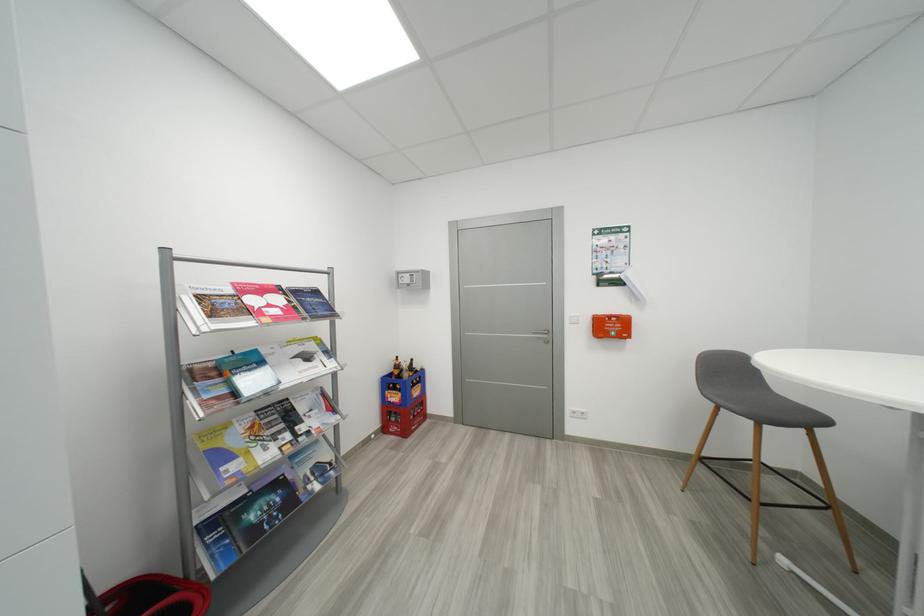
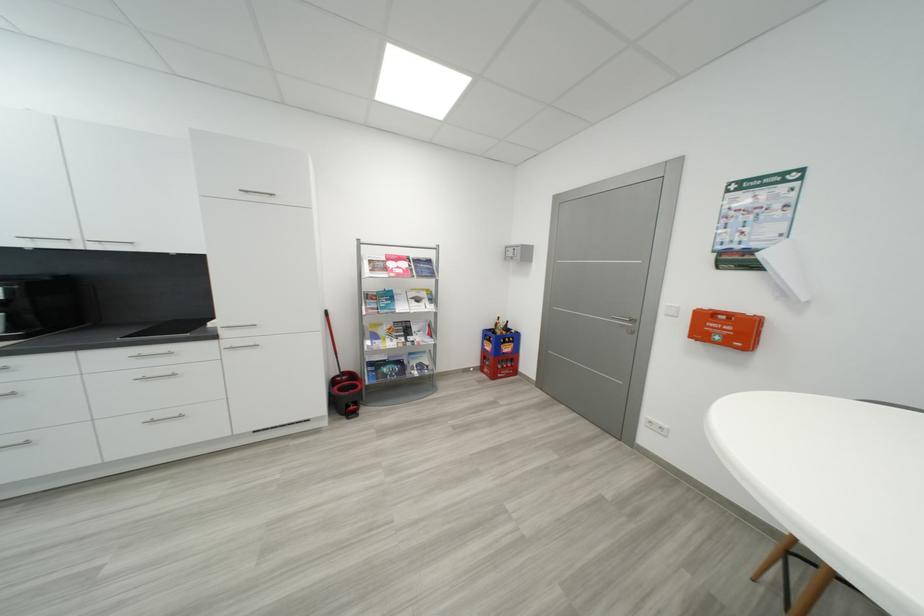
Locate, in the second image, the point that corresponds to point 309,410 in the first image.

(421, 330)